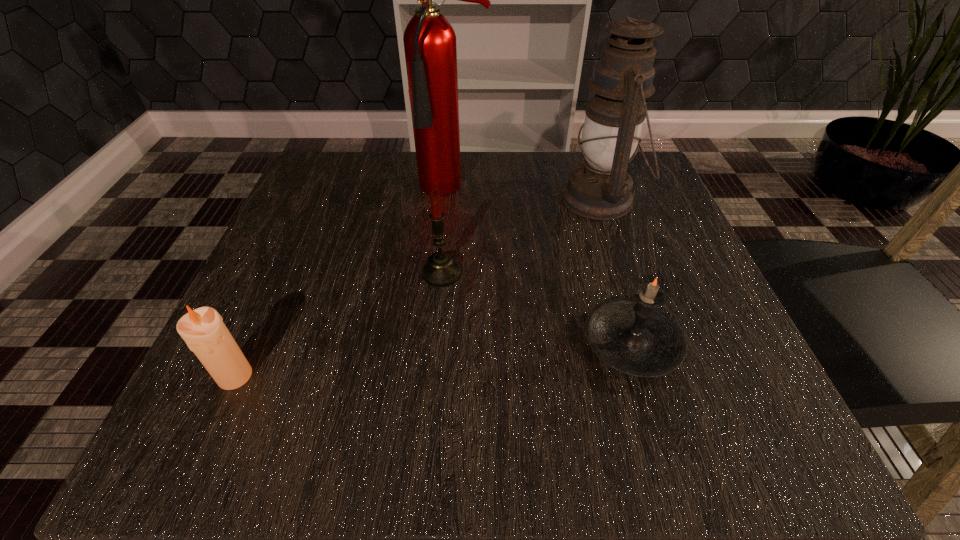
In the image, there is a desktop. Find the location of `vacant space at the far left corner`. vacant space at the far left corner is located at coordinates (332, 173).

Where is `vacant space at the far right corner of the desktop`? The image size is (960, 540). vacant space at the far right corner of the desktop is located at coordinates (638, 213).

Image resolution: width=960 pixels, height=540 pixels. I want to click on free space at the near right corner of the desktop, so click(718, 411).

The width and height of the screenshot is (960, 540). In order to click on vacant space that is in between the second tallest object and the fire extinguisher in this screenshot , I will do `click(527, 194)`.

The image size is (960, 540). Find the location of `vacant space in between the second candle from right to left and the oil lamp`. vacant space in between the second candle from right to left and the oil lamp is located at coordinates (521, 236).

Locate an element on the screen. The height and width of the screenshot is (540, 960). free space between the second tallest object and the fire extinguisher is located at coordinates (527, 194).

I want to click on free space that is in between the leftmost candle and the rightmost candle, so click(x=434, y=359).

This screenshot has width=960, height=540. Identify the location of vacant area that lies between the second candle from right to left and the oil lamp. (521, 236).

Locate an element on the screen. The image size is (960, 540). free space between the leftmost object and the second tallest object is located at coordinates (418, 287).

Identify the location of empty space that is in between the second candle from left to right and the rightmost candle. This screenshot has height=540, width=960. (537, 308).